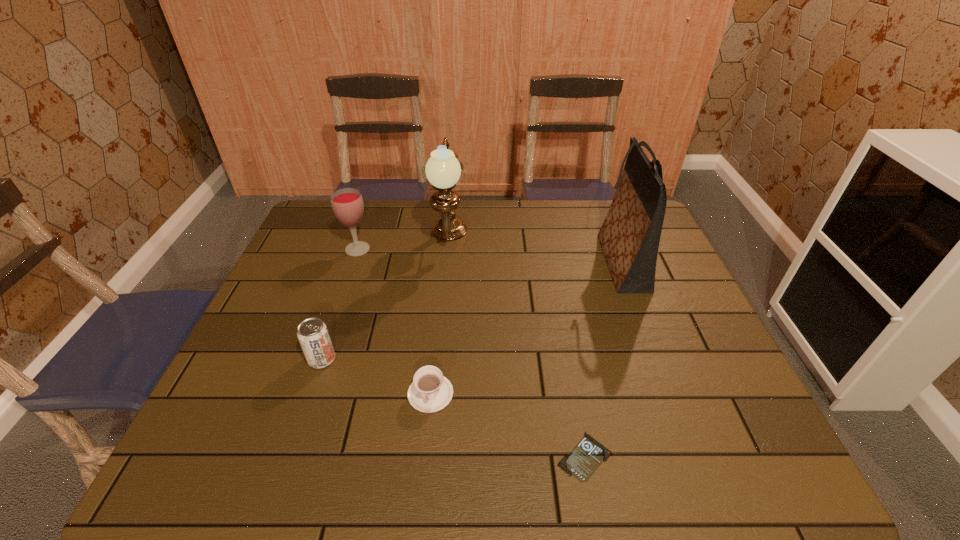
This screenshot has width=960, height=540. I want to click on vacant space located 0.090m on the front-facing side of the shopping bag, so click(x=566, y=262).

You are a GUI agent. You are given a task and a screenshot of the screen. Output one action in this format:
    pyautogui.click(x=<x>, y=<y>)
    Task: Click on the vacant area situated on the front-facing side of the shopping bag
    
    Given the screenshot: What is the action you would take?
    pyautogui.click(x=489, y=262)

The image size is (960, 540). Identify the location of vacant area located on the front of the oil lamp. tap(442, 330).

Locate an element on the screen. The width and height of the screenshot is (960, 540). free space located on the left of the wineglass is located at coordinates (327, 249).

The height and width of the screenshot is (540, 960). Identify the location of free region located 0.150m on the right of the third shortest object. (397, 359).

Identify the location of vacant space situated on the handle side of the teacup. This screenshot has width=960, height=540. (423, 468).

At what (x,y) coordinates should I click in order to perform the action: click on vacant space located 0.170m on the left of the shortest object. Please return your answer as a coordinate pair (x, y). This screenshot has height=540, width=960. Looking at the image, I should click on (471, 456).

At what (x,y) coordinates should I click in order to perform the action: click on shopping bag that is at the far edge. Please return your answer as a coordinate pair (x, y). This screenshot has height=540, width=960. Looking at the image, I should click on (629, 237).

The image size is (960, 540). In order to click on oil lamp positioned at the far edge in this screenshot , I will do `click(443, 170)`.

Find the location of a particular element. This screenshot has height=540, width=960. object at the near edge is located at coordinates (586, 457).